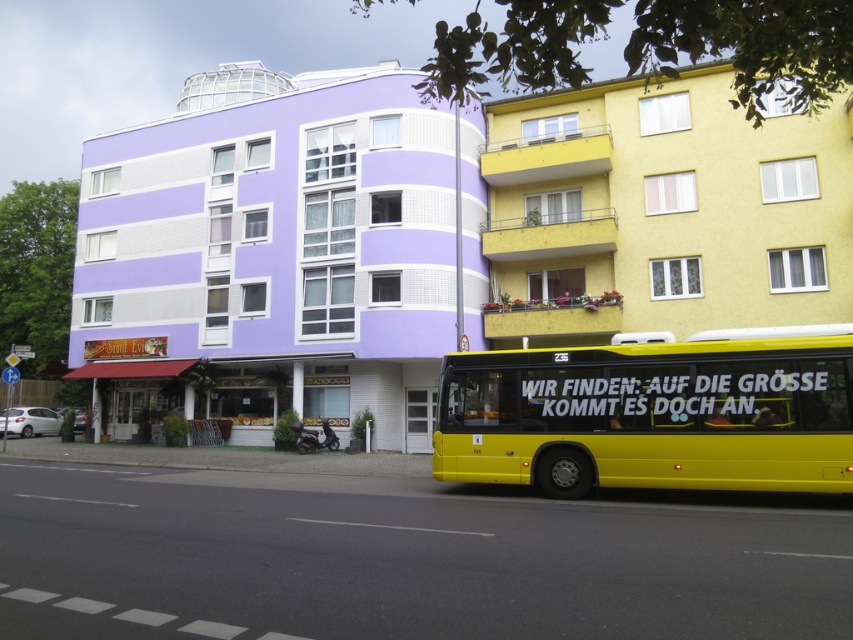
Does purple matte building at center appear under yellow metallic bus at lower right?

No, purple matte building at center is not below yellow metallic bus at lower right.

Is purple matte building at center behind yellow metallic bus at lower right?

Yes, it is.

This screenshot has width=853, height=640. In order to click on purple matte building at center in this screenshot , I will do `click(271, 252)`.

Can you confirm if yellow textured building at upper right is wider than yellow metallic bus at lower right?

Yes, yellow textured building at upper right is wider than yellow metallic bus at lower right.

Is yellow textured building at upper right to the left of yellow metallic bus at lower right from the viewer's perspective?

Incorrect, yellow textured building at upper right is not on the left side of yellow metallic bus at lower right.

Is point (509, 305) behind point (756, 424)?

That is True.

Where is `yellow textured building at upper right`? The image size is (853, 640). yellow textured building at upper right is located at coordinates (660, 212).

Is purple matte building at center behind yellow textured building at upper right?

Yes, it is.

Between purple matte building at center and yellow textured building at upper right, which one is positioned lower?

Positioned lower is yellow textured building at upper right.

Where is `purple matte building at center`? This screenshot has width=853, height=640. purple matte building at center is located at coordinates coord(271,252).